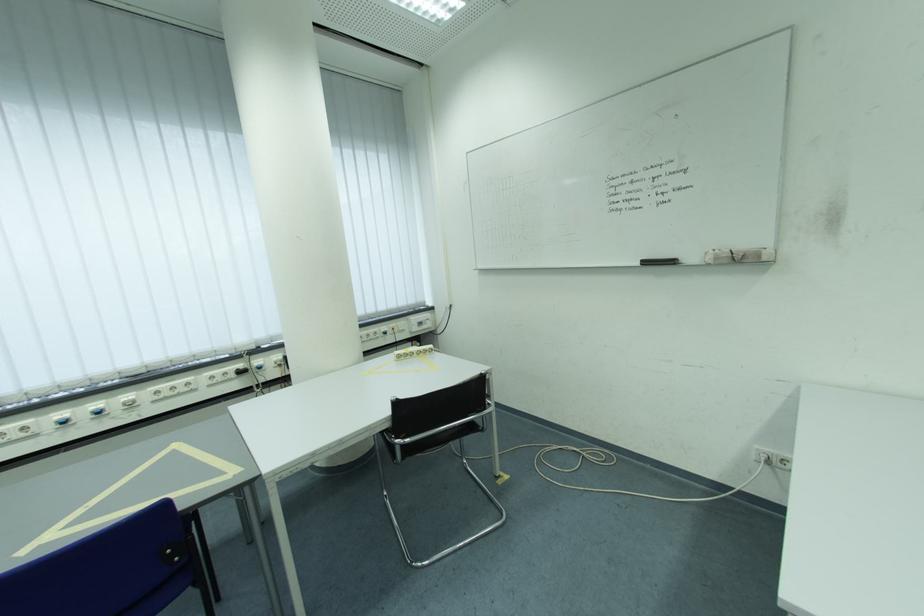
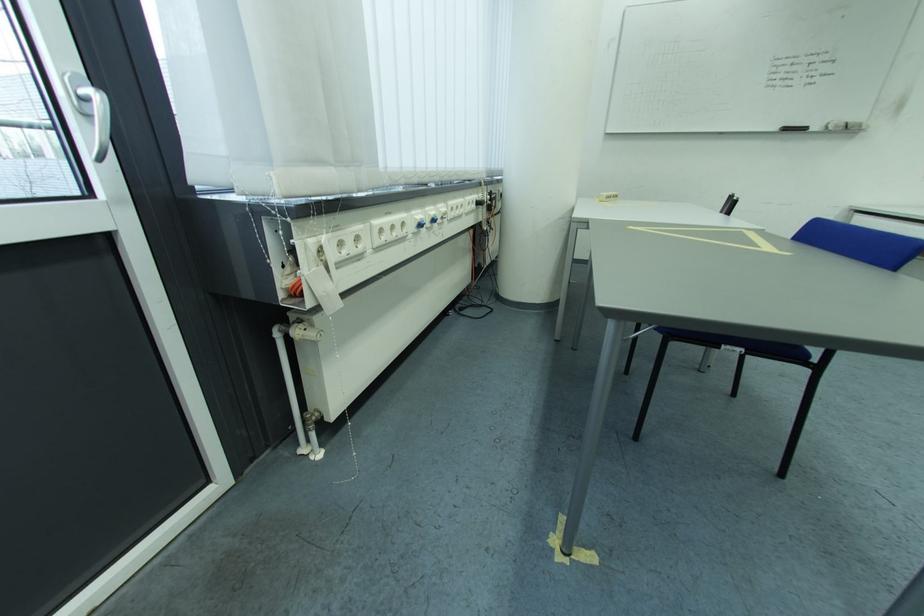
The point at (140, 400) is marked in the first image. Where is the corresponding point in the second image?

(454, 212)